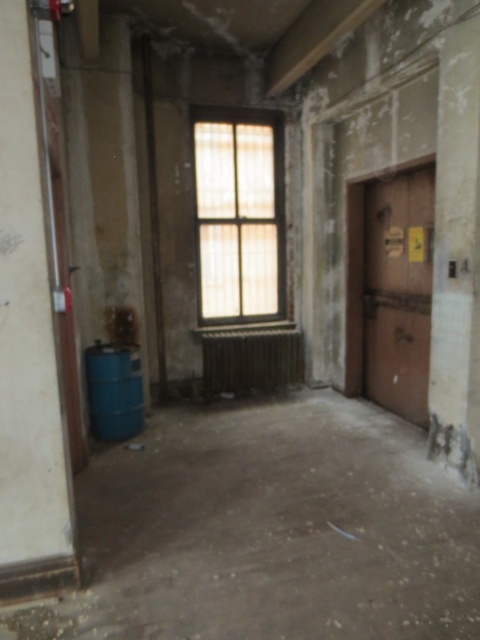
Between translucent wood window at center and wooden door at right, which one has more height?

With more height is translucent wood window at center.

How distant is translucent wood window at center from wooden door at right?

translucent wood window at center is 5.00 feet away from wooden door at right.

Is point (218, 193) more distant than point (394, 301)?

Yes, it is.

Image resolution: width=480 pixels, height=640 pixels. I want to click on translucent wood window at center, so click(239, 214).

Is wooden door at right smaller than blue matte barrel at lower left?

No.

Who is more distant from viewer, (423,358) or (134,392)?

The point (134,392) is behind.

Find the location of a particular element. wooden door at right is located at coordinates pos(397,291).

I want to click on wooden door at right, so click(397, 291).